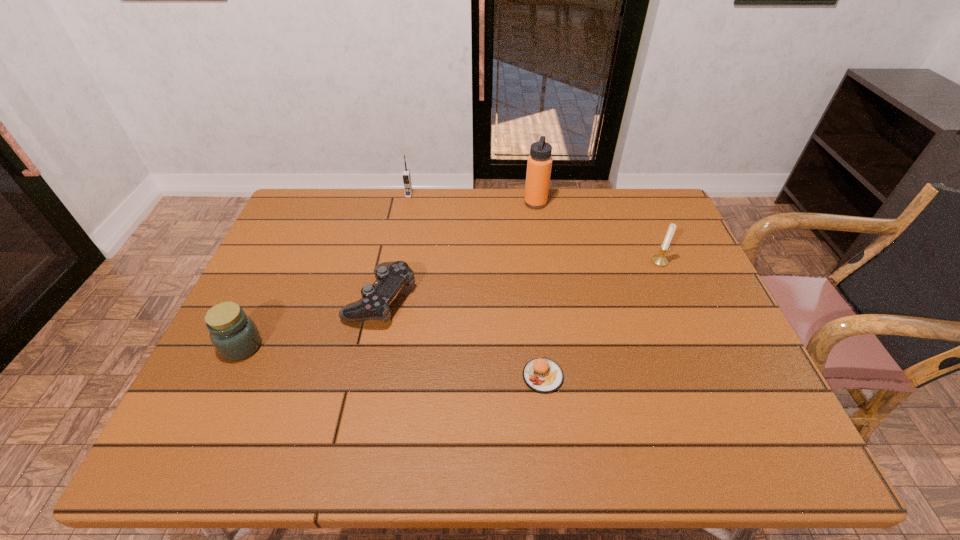
Locate an element on the screen. The height and width of the screenshot is (540, 960). blank space at the right edge of the desktop is located at coordinates (636, 240).

The image size is (960, 540). I want to click on free region at the far left corner of the desktop, so click(x=295, y=230).

Locate an element on the screen. The height and width of the screenshot is (540, 960). blank space at the near left corner is located at coordinates (242, 446).

Locate an element on the screen. Image resolution: width=960 pixels, height=540 pixels. free space at the far right corner is located at coordinates (636, 207).

You are a GUI agent. You are given a task and a screenshot of the screen. Output one action in this format:
    pyautogui.click(x=<x>, y=<y>)
    Task: Click on the free area in between the tallest object and the control
    The height and width of the screenshot is (540, 960).
    Given the screenshot: What is the action you would take?
    pyautogui.click(x=458, y=251)

Locate an element on the screen. The image size is (960, 540). free spot between the cellular telephone and the jar is located at coordinates (325, 271).

The height and width of the screenshot is (540, 960). I want to click on empty space that is in between the jar and the cellular telephone, so click(325, 271).

This screenshot has height=540, width=960. In order to click on unoccupied area between the control and the shortest object in this screenshot , I will do `click(462, 338)`.

Locate an element on the screen. vacant area that lies between the patty and the control is located at coordinates (462, 338).

Identify the location of empty space that is in between the thermos bottle and the fourth nearest object. tap(597, 232).